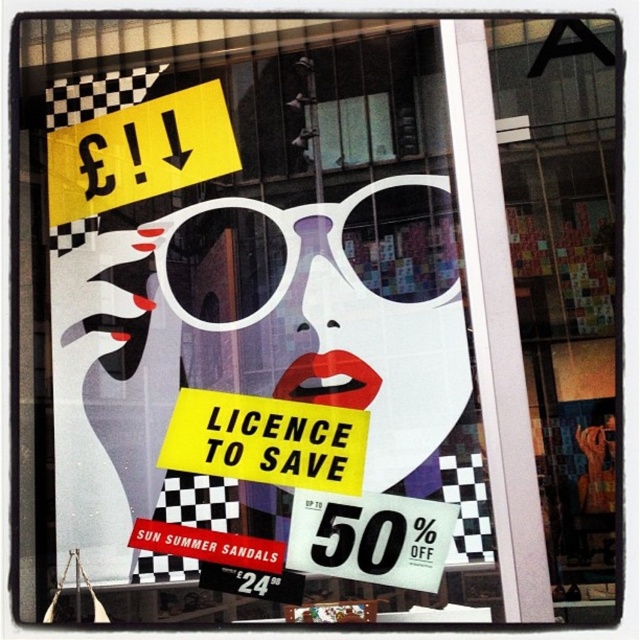
Question: Which object is farther from the camera taking this photo?

Choices:
 (A) yellow paper at upper left
 (B) white plastic goggles at center

Answer: (A)

Question: Considering the relative positions of yellow paper at upper left and white plastic goggles at center in the image provided, where is yellow paper at upper left located with respect to white plastic goggles at center?

Choices:
 (A) above
 (B) below

Answer: (A)

Question: Is yellow paper at center thinner than white plastic goggles at center?

Choices:
 (A) no
 (B) yes

Answer: (B)

Question: Which point is closer to the camera taking this photo?

Choices:
 (A) (134, 200)
 (B) (81, 417)

Answer: (B)

Question: Which of the following is the farthest from the observer?

Choices:
 (A) pyautogui.click(x=374, y=157)
 (B) pyautogui.click(x=134, y=152)

Answer: (B)

Question: Can you confirm if checkerboard glass at upper right is positioned below yellow paper at center?

Choices:
 (A) no
 (B) yes

Answer: (A)